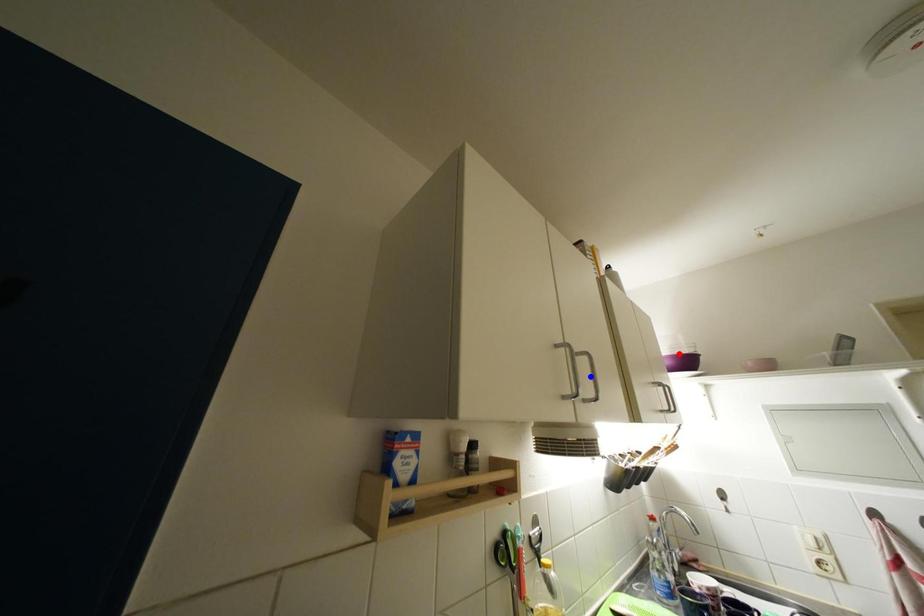
Question: Which of the two points in the image is closer to the camera?

Choices:
 (A) Blue point is closer.
 (B) Red point is closer.

Answer: (A)